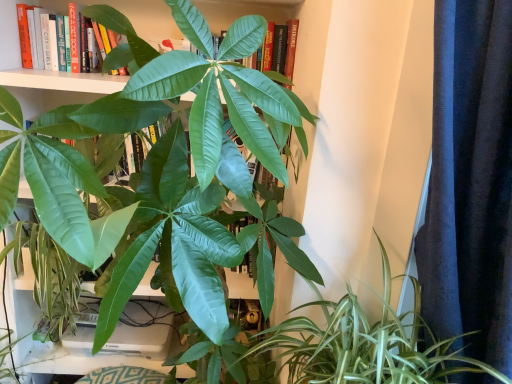
Question: In the image, is green glossy leafy plant at lower right on the left side or the right side of green matte leaf at upper center?

Choices:
 (A) left
 (B) right

Answer: (B)

Question: From a real-world perspective, is green glossy leafy plant at lower right positioned above or below green matte leaf at upper center?

Choices:
 (A) below
 (B) above

Answer: (A)

Question: Based on their relative distances, which object is nearer to the green matte leaf at upper center?

Choices:
 (A) dark blue textured curtain at right
 (B) green glossy leafy plant at lower right

Answer: (A)

Question: Considering the real-world distances, which object is closest to the green matte leaf at upper center?

Choices:
 (A) dark blue textured curtain at right
 (B) green glossy leafy plant at lower right

Answer: (A)